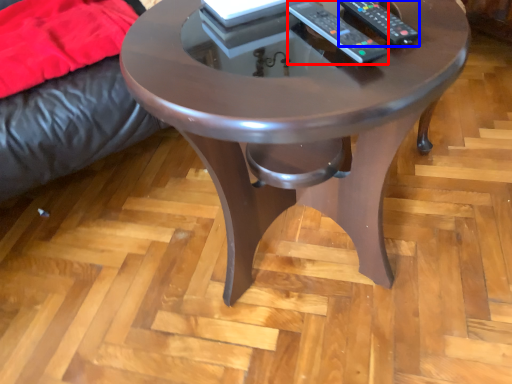
Question: Among these objects, which one is nearest to the camera, remote (highlighted by a red box) or remote (highlighted by a blue box)?

Choices:
 (A) remote
 (B) remote

Answer: (A)